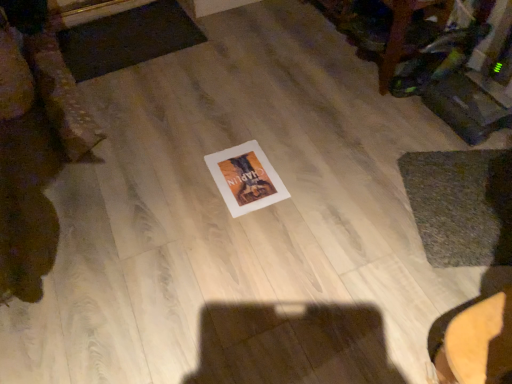
Question: In terms of height, does white paper at center look taller or shorter compared to wooden table at upper right?

Choices:
 (A) tall
 (B) short

Answer: (B)

Question: Is white paper at center inside or outside of wooden table at upper right?

Choices:
 (A) inside
 (B) outside

Answer: (B)

Question: Which object is the closest to the green textured mat at lower right, which is counted as the 2th mat, starting from the left?

Choices:
 (A) dark gray textured mat at upper left, which is the 2th mat in right-to-left order
 (B) wooden table at upper right
 (C) white paper at center

Answer: (B)

Question: Which of these objects is positioned closest to the wooden table at upper right?

Choices:
 (A) dark gray textured mat at upper left, which appears as the 1th mat when viewed from the top
 (B) white paper at center
 (C) green textured mat at lower right, marked as the second mat in a top-to-bottom arrangement

Answer: (C)